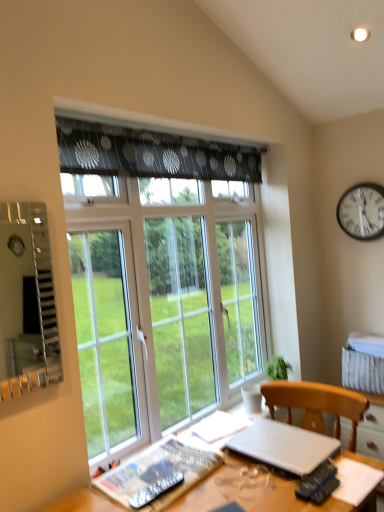
Find the location of `vacant space situated on the left part of silver metallic laptop at lower right`. vacant space situated on the left part of silver metallic laptop at lower right is located at coordinates (210, 453).